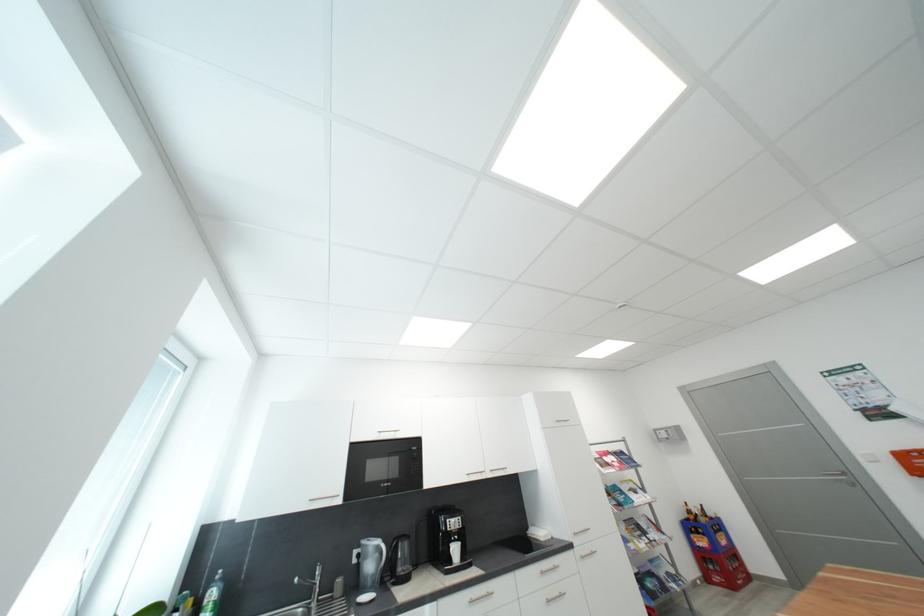
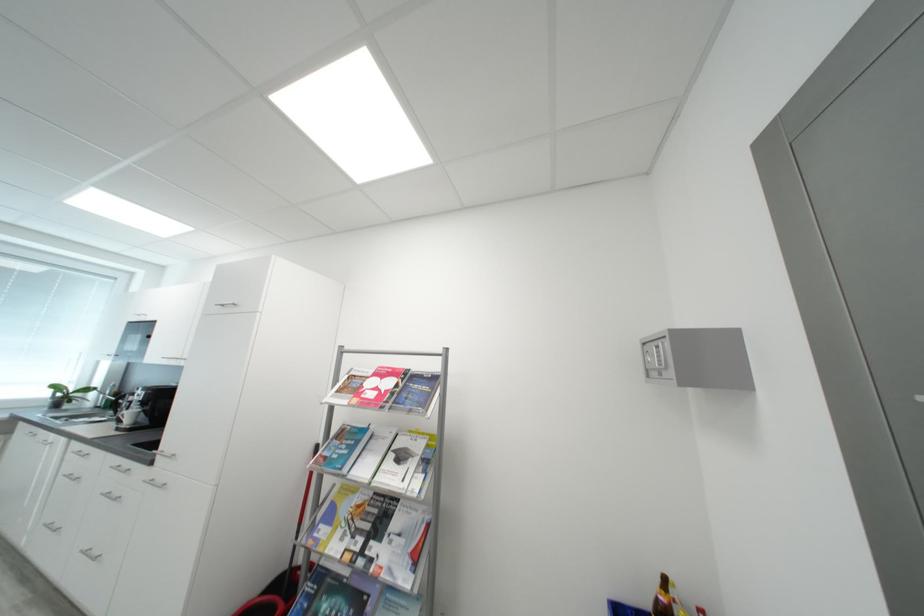
The point at (675, 437) is marked in the first image. Where is the corresponding point in the second image?

(666, 362)